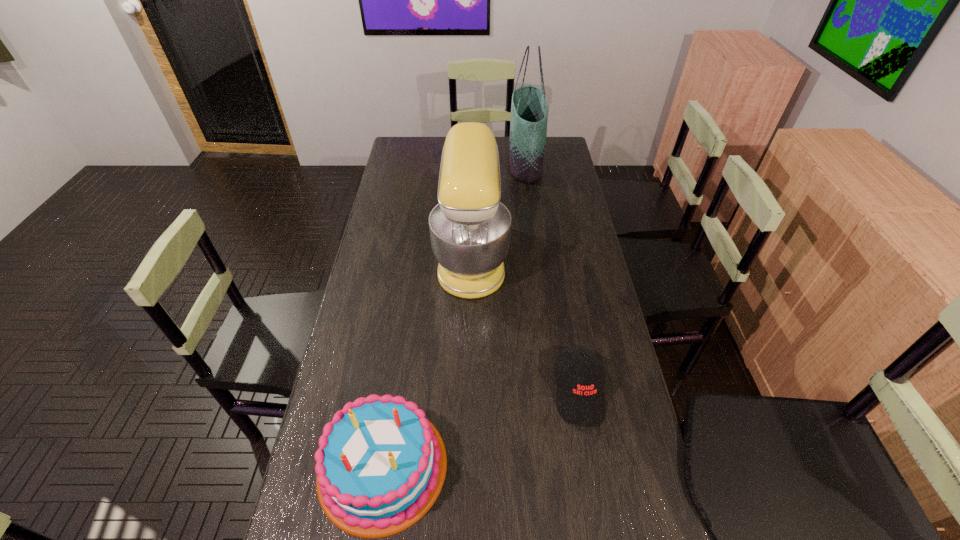
You are a GUI agent. You are given a task and a screenshot of the screen. Output one action in this format:
    pyautogui.click(x=<x>, y=<y>)
    Task: Click on the object situated at the far edge
    This screenshot has width=960, height=540.
    Given the screenshot: What is the action you would take?
    pyautogui.click(x=529, y=109)

Find the location of `object at the left edge`. object at the left edge is located at coordinates (380, 465).

Where is `tote bag that is positioned at the right edge`? tote bag that is positioned at the right edge is located at coordinates (529, 109).

Find the location of a particular element. This screenshot has height=540, width=960. baseball cap that is positioned at the right edge is located at coordinates (580, 397).

At what (x,y) coordinates should I click in order to perform the action: click on object that is at the far right corner. Please return your answer as a coordinate pair (x, y). The width and height of the screenshot is (960, 540). Looking at the image, I should click on (529, 109).

The width and height of the screenshot is (960, 540). I want to click on vacant space at the left edge of the desktop, so click(378, 228).

Identify the location of vacant region at the right edge. (599, 345).

Where is `vacant space at the far left corner of the desktop`? This screenshot has width=960, height=540. vacant space at the far left corner of the desktop is located at coordinates (415, 153).

Where is `vacant space in between the shortest object and the second shortest object`? vacant space in between the shortest object and the second shortest object is located at coordinates (481, 428).

In order to click on vacant point located between the birthday cake and the third nearest object in this screenshot , I will do `click(427, 361)`.